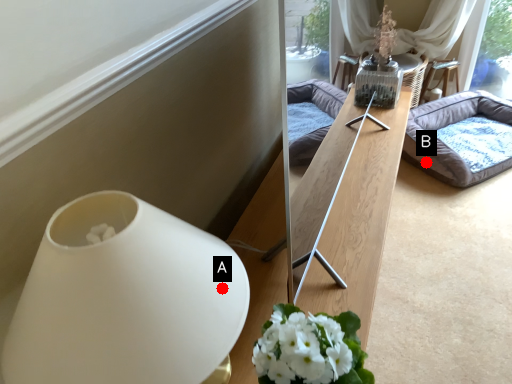
Question: Two points are circled on the image, labeled by A and B beside each circle. Which of the following is the farthest from the observer?

Choices:
 (A) A is further
 (B) B is further

Answer: (B)